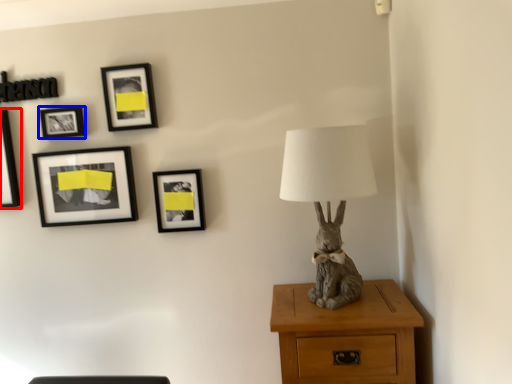
Question: Among these objects, which one is nearest to the camera, picture frame (highlighted by a red box) or picture frame (highlighted by a blue box)?

Choices:
 (A) picture frame
 (B) picture frame

Answer: (B)